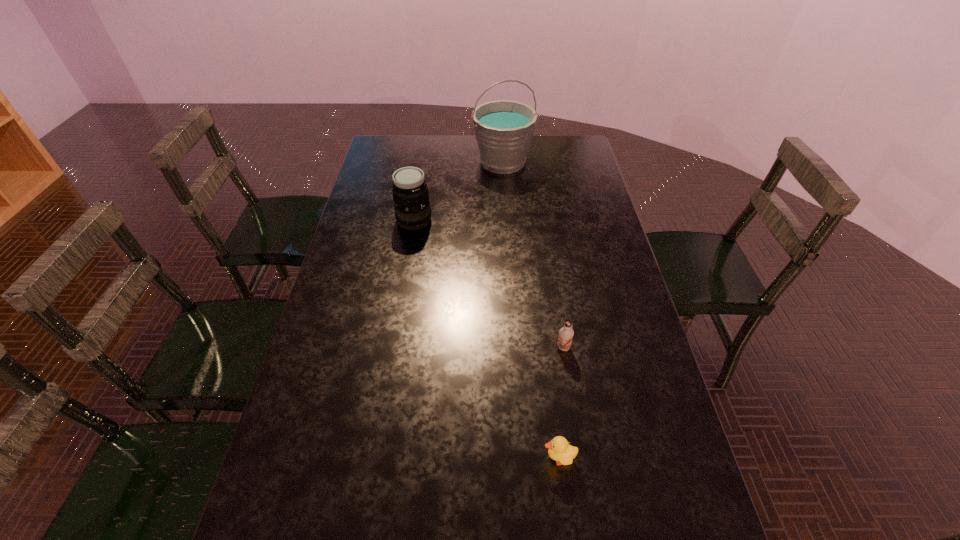
This screenshot has height=540, width=960. I want to click on free space at the far right corner of the desktop, so click(563, 153).

I want to click on vacant area that lies between the telephoto lens and the farthest object, so click(459, 191).

Where is `unoccupied area between the farthest object and the chocolate milk`? The height and width of the screenshot is (540, 960). unoccupied area between the farthest object and the chocolate milk is located at coordinates (533, 255).

Identify the location of vacant area between the shortest object and the second farthest object. pyautogui.click(x=487, y=339).

The image size is (960, 540). I want to click on empty space that is in between the leftmost object and the nearest object, so click(487, 339).

You are a GUI agent. You are given a task and a screenshot of the screen. Output one action in this format:
    pyautogui.click(x=<x>, y=<y>)
    Task: Click on the vacant area between the second nearest object and the shortest object
    
    Given the screenshot: What is the action you would take?
    pyautogui.click(x=561, y=403)

This screenshot has width=960, height=540. I want to click on vacant area that lies between the shortest object and the second nearest object, so click(561, 403).

Find the location of a particular element. The width and height of the screenshot is (960, 540). empty space that is in between the farthest object and the duckling is located at coordinates (531, 310).

Where is `vacant point located between the third shortest object and the tallest object`? The image size is (960, 540). vacant point located between the third shortest object and the tallest object is located at coordinates (459, 191).

I want to click on vacant area that lies between the telephoto lens and the second nearest object, so click(x=489, y=284).